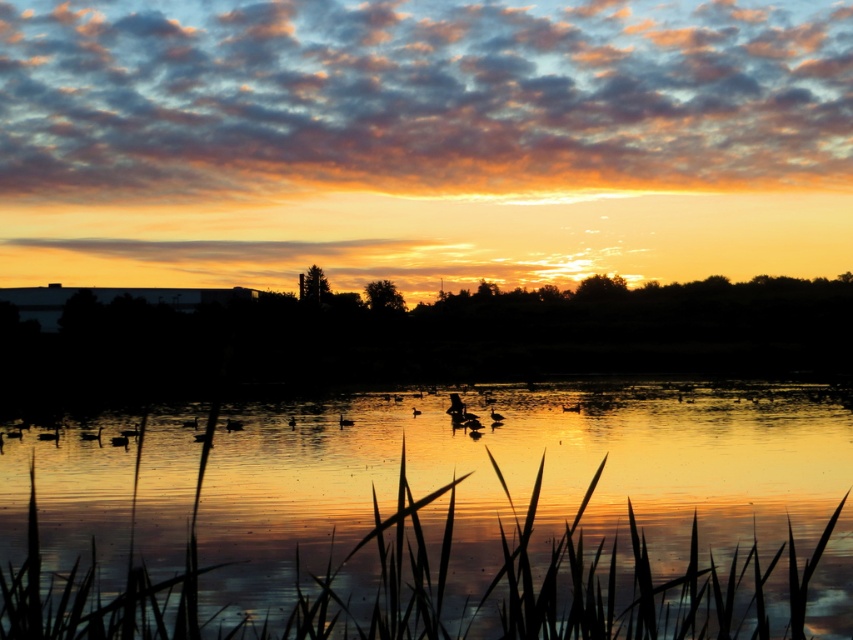
Question: Is reflective golden water at center wider than silvery glossy duck at center?

Choices:
 (A) no
 (B) yes

Answer: (B)

Question: Which point is closer to the camera taking this photo?

Choices:
 (A) click(x=343, y=422)
 (B) click(x=49, y=438)

Answer: (B)

Question: Among these objects, which one is farthest from the camera?

Choices:
 (A) reflective golden water at center
 (B) silhouette feathered duck at lower left
 (C) silvery glossy duck at center

Answer: (C)

Question: Which point is farther from the camera taking this photo?

Choices:
 (A) (44, 435)
 (B) (341, 420)
 (C) (554, 452)

Answer: (B)

Question: Does silhouette feathered duck at lower left appear on the left side of silvery glossy duck at center?

Choices:
 (A) no
 (B) yes

Answer: (B)

Question: In this image, where is silhouette feathered duck at lower left located relative to silvery glossy duck at center?

Choices:
 (A) left
 (B) right

Answer: (A)